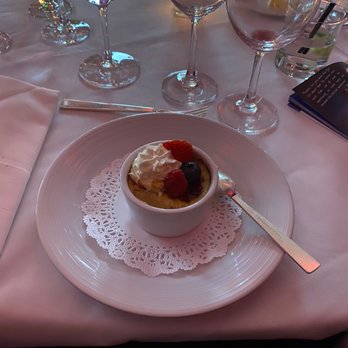
Where is `spoon`? Image resolution: width=348 pixels, height=348 pixels. spoon is located at coordinates (233, 195).